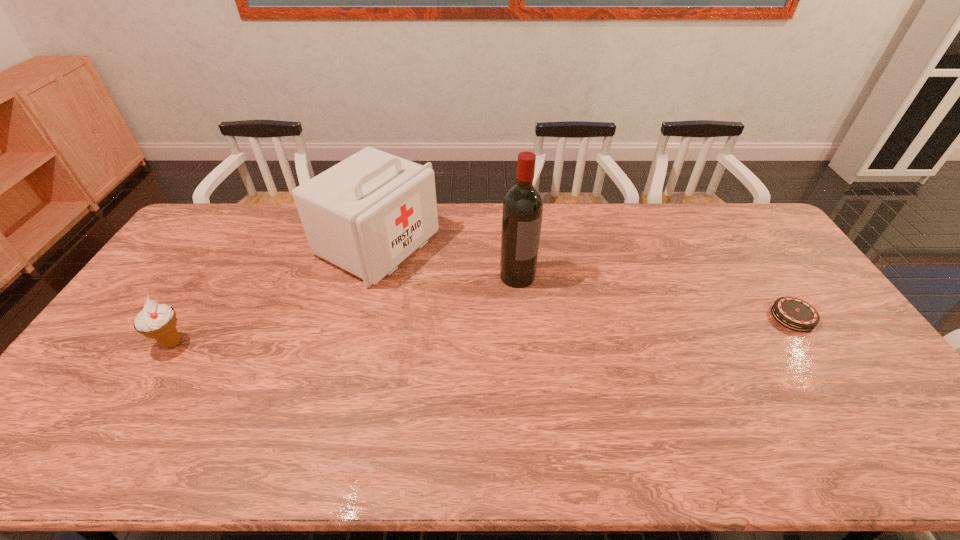
This screenshot has height=540, width=960. I want to click on free space on the desktop that is between the leftmost object and the shortest object and is positioned on the front-facing side of the first-aid kit, so click(x=553, y=327).

The image size is (960, 540). I want to click on vacant space on the desktop that is between the leftmost object and the shortest object and is positioned on the label of the wine bottle, so click(562, 327).